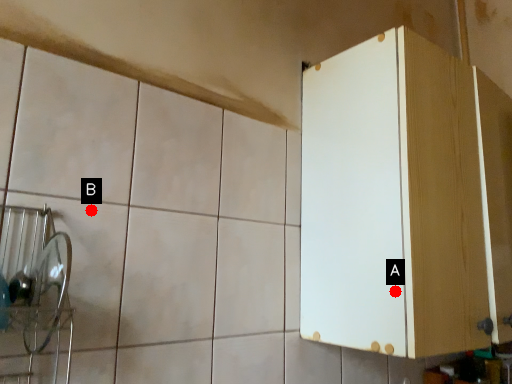
Question: Two points are circled on the image, labeled by A and B beside each circle. Which point appears farthest from the camera in this image?

Choices:
 (A) A is further
 (B) B is further

Answer: (A)